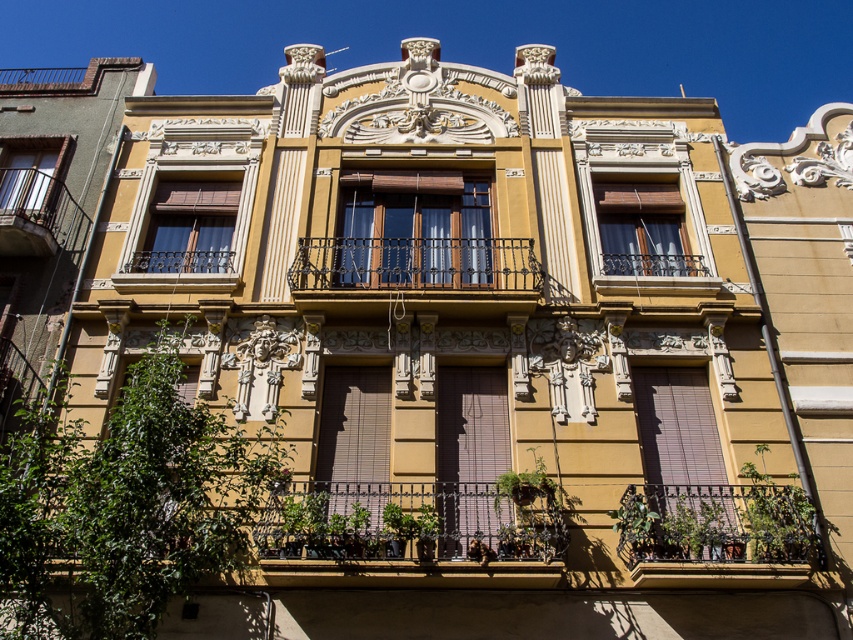
You are an architect designing a new building and want to ensure the rustic wrought iron balcony at lower right and the matte brown wood window at left are proportionate. According to the scene, which object is wider?

The rustic wrought iron balcony at lower right is wider than the matte brown wood window at left.

You are standing in front of the ornate building and notice two points marked on its facade. The first point is at coordinate point[662,538] and the second is at point[207,225]. From your perspective, which point appears closer to you?

Point[662,538] is in front of point[207,225], so it appears closer to you.

You are standing in front of the ornate building and want to take a photo of the matte brown wood window at center. Considering your camera has a maximum focus range of 25 meters, will you be able to capture it clearly?

The matte brown wood window at center is 25.60 meters from the camera, which exceeds the camera maximum focus range of 25 meters. Therefore, it won